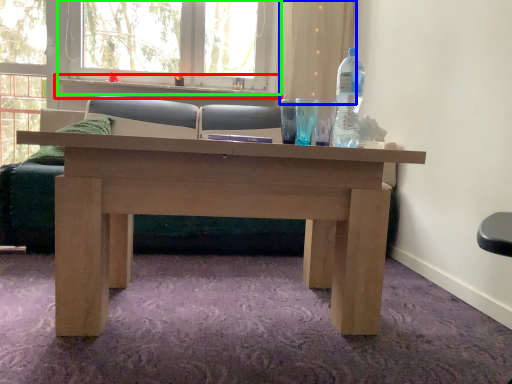
Question: Which object is the closest to the window sill (highlighted by a red box)? Choose among these: curtain (highlighted by a blue box) or window frame (highlighted by a green box).

Choices:
 (A) curtain
 (B) window frame

Answer: (B)